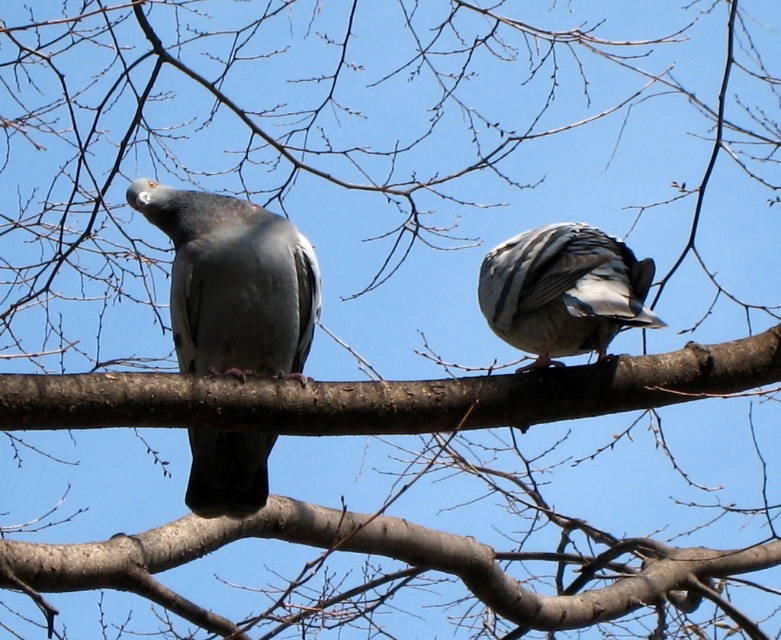
Question: Which of the following is the closest to the observer?

Choices:
 (A) brown rough branch at center
 (B) speckled gray pigeon at center
 (C) gray matte pigeon at left

Answer: (A)

Question: Can you confirm if brown rough branch at center is positioned to the left of speckled gray pigeon at center?

Choices:
 (A) yes
 (B) no

Answer: (A)

Question: Is brown rough branch at center further to camera compared to speckled gray pigeon at center?

Choices:
 (A) no
 (B) yes

Answer: (A)

Question: Which of these objects is positioned farthest from the gray matte pigeon at left?

Choices:
 (A) brown rough branch at center
 (B) speckled gray pigeon at center

Answer: (B)

Question: Can you confirm if gray matte pigeon at left is bigger than speckled gray pigeon at center?

Choices:
 (A) yes
 (B) no

Answer: (A)

Question: Which point is farther from the camera taking this photo?

Choices:
 (A) (508, 269)
 (B) (209, 433)

Answer: (B)